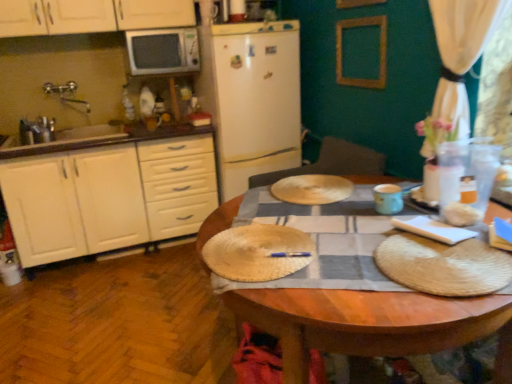
Question: In terms of width, does matte blue cup at center right look wider or thinner when compared to white matte microwave at upper left?

Choices:
 (A) wide
 (B) thin

Answer: (B)

Question: Is matte blue cup at center right taller or shorter than white matte microwave at upper left?

Choices:
 (A) tall
 (B) short

Answer: (B)

Question: Which is nearer to the white matte microwave at upper left?

Choices:
 (A) white matte cabinet at left
 (B) bamboo placemat at center
 (C) wooden frame at upper center
 (D) white fabric curtain at upper right
 (E) white matte refrigerator at center

Answer: (E)

Question: Which object is positioned closest to the white matte cabinet at left?

Choices:
 (A) matte blue cup at center right
 (B) white matte microwave at upper left
 (C) white fabric curtain at upper right
 (D) white matte refrigerator at center
 (E) bamboo placemat at center

Answer: (D)